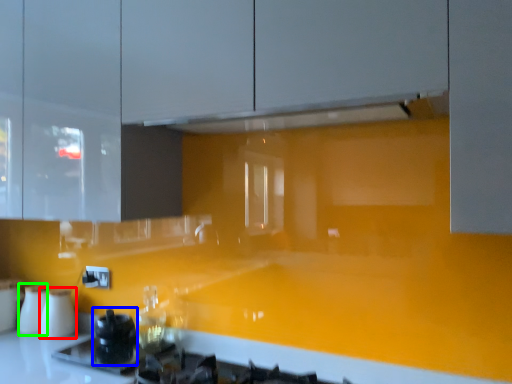
Question: Based on their relative distances, which object is nearer to appliance (highlighted by a red box)? Choose from appliance (highlighted by a blue box) and appliance (highlighted by a green box).

Choices:
 (A) appliance
 (B) appliance

Answer: (B)